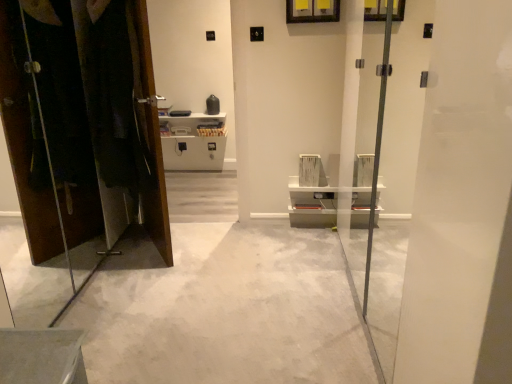
What do you see at coordinates (114, 93) in the screenshot? The height and width of the screenshot is (384, 512). I see `dark fabric laundry at left` at bounding box center [114, 93].

Image resolution: width=512 pixels, height=384 pixels. I want to click on transparent glass screen door at center, so click(x=433, y=189).

What do you see at coordinates (79, 139) in the screenshot? I see `matte brown dresser at left` at bounding box center [79, 139].

Where is `dark fabric laundry at left`? The image size is (512, 384). dark fabric laundry at left is located at coordinates (114, 93).

Can we say dark fabric laundry at left lies outside matte brown dresser at left?

dark fabric laundry at left lies outside matte brown dresser at left's area.

I want to click on dresser lying in front of the dark fabric laundry at left, so click(x=79, y=139).

Is dark fabric laundry at left far away from matte brown dresser at left?

That's not correct — dark fabric laundry at left is a little close to matte brown dresser at left.

Looking at this image, is white concrete floor at center at the back of dark fabric laundry at left?

That's not correct — dark fabric laundry at left is not looking away from white concrete floor at center.

Between dark fabric laundry at left and white concrete floor at center, which one has smaller size?

With smaller size is dark fabric laundry at left.

Considering the sizes of objects dark fabric laundry at left and white concrete floor at center in the image provided, who is thinner, dark fabric laundry at left or white concrete floor at center?

Thinner between the two is dark fabric laundry at left.

Between point (96, 89) and point (169, 316), which one is positioned behind?

The point (96, 89) is farther from the camera.

Considering the sizes of objects white concrete floor at center and transparent glass screen door at center in the image provided, who is taller, white concrete floor at center or transparent glass screen door at center?

transparent glass screen door at center is taller.

How different are the orientations of white concrete floor at center and transparent glass screen door at center in degrees?

The angle between the facing direction of white concrete floor at center and the facing direction of transparent glass screen door at center is 90.2 degrees.

Between white concrete floor at center and transparent glass screen door at center, which one has smaller width?

transparent glass screen door at center is thinner.

Identify the location of concrete lying on the left of transparent glass screen door at center. (223, 310).

From the picture: Does dark fabric laundry at left touch transparent glass screen door at center?

dark fabric laundry at left and transparent glass screen door at center are not in contact.

Is point (84, 63) positioned after point (462, 57)?

Yes, point (84, 63) is farther from viewer.

Considering the sizes of dark fabric laundry at left and transparent glass screen door at center in the image, is dark fabric laundry at left wider or thinner than transparent glass screen door at center?

dark fabric laundry at left is thinner than transparent glass screen door at center.

Does point (70, 315) come farther from viewer compared to point (112, 166)?

No, it is in front of (112, 166).

From a real-world perspective, between white concrete floor at center and dark fabric laundry at left, who is vertically higher?

dark fabric laundry at left.

From the image's perspective, would you say white concrete floor at center is shown under dark fabric laundry at left?

Indeed, from the image's perspective, white concrete floor at center is shown beneath dark fabric laundry at left.

Is there a large distance between white concrete floor at center and dark fabric laundry at left?

No, white concrete floor at center is in close proximity to dark fabric laundry at left.

Could you tell me if transparent glass screen door at center is turned towards matte brown dresser at left?

Yes, transparent glass screen door at center is oriented towards matte brown dresser at left.

Is transparent glass screen door at center closer to camera compared to matte brown dresser at left?

Yes, it is in front of matte brown dresser at left.

Who is smaller, transparent glass screen door at center or matte brown dresser at left?

With smaller size is matte brown dresser at left.

Can you confirm if transparent glass screen door at center is thinner than matte brown dresser at left?

Incorrect, the width of transparent glass screen door at center is not less than that of matte brown dresser at left.

Is transparent glass screen door at center in front of dark fabric laundry at left?

Yes, transparent glass screen door at center is in front of dark fabric laundry at left.

The image size is (512, 384). I want to click on laundry behind the transparent glass screen door at center, so click(x=114, y=93).

Between transparent glass screen door at center and dark fabric laundry at left, which one has less height?

dark fabric laundry at left is shorter.

The height and width of the screenshot is (384, 512). In order to click on laundry on the right of matte brown dresser at left in this screenshot , I will do `click(114, 93)`.

The image size is (512, 384). What are the coordinates of `laundry above the white concrete floor at center (from the image's perspective)` in the screenshot? It's located at (114, 93).

Considering their positions, is dark fabric laundry at left positioned closer to white concrete floor at center than transparent glass screen door at center?

transparent glass screen door at center.

Considering their positions, is dark fabric laundry at left positioned closer to transparent glass screen door at center than matte brown dresser at left?

dark fabric laundry at left.

Estimate the real-world distances between objects in this image. Which object is further from transparent glass screen door at center, matte brown dresser at left or dark fabric laundry at left?

Among the two, matte brown dresser at left is located further to transparent glass screen door at center.

Estimate the real-world distances between objects in this image. Which object is further from transparent glass screen door at center, matte brown dresser at left or white concrete floor at center?

matte brown dresser at left is positioned further to the anchor transparent glass screen door at center.

When comparing their distances from transparent glass screen door at center, does white concrete floor at center or dark fabric laundry at left seem closer?

white concrete floor at center is closer to transparent glass screen door at center.

Which object lies further to the anchor point matte brown dresser at left, transparent glass screen door at center or white concrete floor at center?

transparent glass screen door at center lies further to matte brown dresser at left than the other object.

Based on their spatial positions, is matte brown dresser at left or transparent glass screen door at center further from dark fabric laundry at left?

transparent glass screen door at center is positioned further to the anchor dark fabric laundry at left.

Based on their spatial positions, is transparent glass screen door at center or white concrete floor at center further from dark fabric laundry at left?

Based on the image, transparent glass screen door at center appears to be further to dark fabric laundry at left.

Identify the location of concrete between matte brown dresser at left and transparent glass screen door at center from left to right. Image resolution: width=512 pixels, height=384 pixels. (223, 310).

At what (x,y) coordinates should I click in order to perform the action: click on laundry between matte brown dresser at left and transparent glass screen door at center. Please return your answer as a coordinate pair (x, y). Looking at the image, I should click on (114, 93).

In order to click on concrete located between dark fabric laundry at left and transparent glass screen door at center in the left-right direction in this screenshot , I will do `click(223, 310)`.

Image resolution: width=512 pixels, height=384 pixels. Find the location of `dresser that lies between dark fabric laundry at left and white concrete floor at center from top to bottom`. dresser that lies between dark fabric laundry at left and white concrete floor at center from top to bottom is located at coordinates (79, 139).